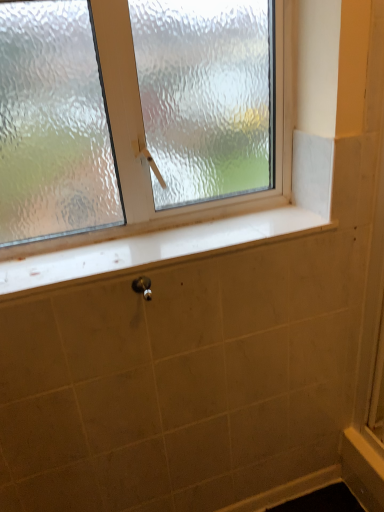
The width and height of the screenshot is (384, 512). I want to click on free spot above white glossy window sill at center (from a real-world perspective), so click(x=165, y=240).